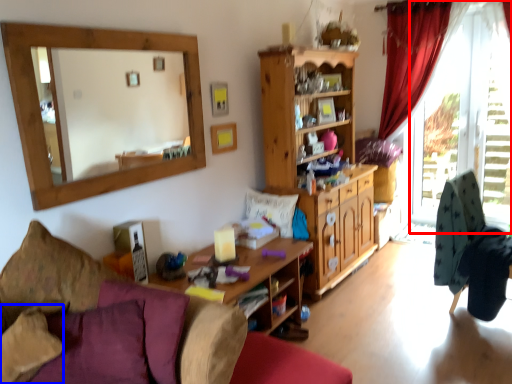
Question: Which of the following is the closest to the observer, window frame (highlighted by a red box) or pillow (highlighted by a blue box)?

Choices:
 (A) window frame
 (B) pillow

Answer: (B)